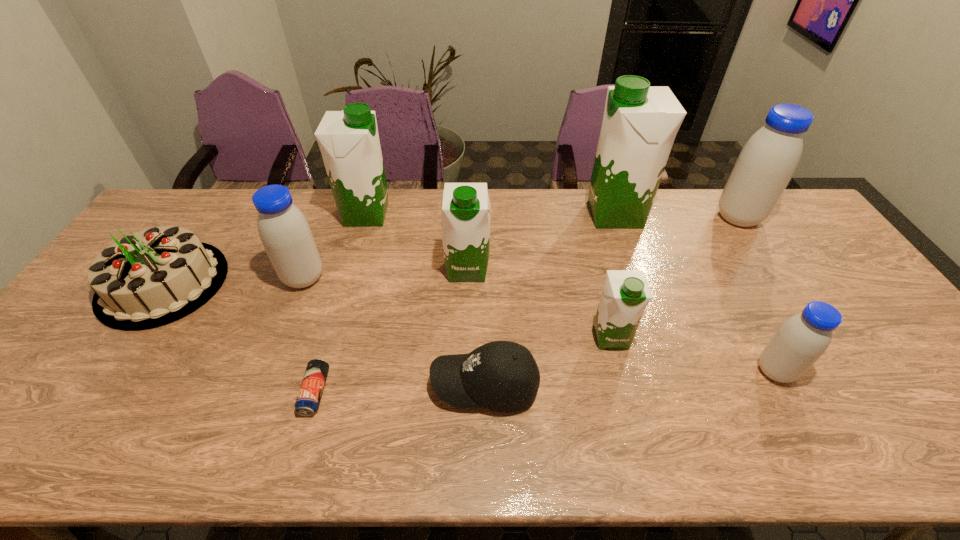
Find the location of `free space in the image that satisfies the following two spatial constraints: 1. on the front-facing side of the ninth object from left to right; 2. on the left side of the third biggest green soya milk`. free space in the image that satisfies the following two spatial constraints: 1. on the front-facing side of the ninth object from left to right; 2. on the left side of the third biggest green soya milk is located at coordinates (465, 371).

This screenshot has height=540, width=960. Identify the location of free region that satisfies the following two spatial constraints: 1. on the front-facing side of the tallest soya milk; 2. on the front-facing side of the second smallest green soya milk. (635, 269).

This screenshot has height=540, width=960. I want to click on free space that satisfies the following two spatial constraints: 1. on the front-facing side of the tallest object; 2. on the back side of the ninth object from left to right, so click(669, 371).

You are a GUI agent. You are given a task and a screenshot of the screen. Output one action in this format:
    pyautogui.click(x=<x>, y=<y>)
    Task: Click on the free point that satisfies the following two spatial constraints: 1. on the front-facing side of the tallest object; 2. on the front-facing side of the fifth soya milk from right to left
    Image resolution: width=960 pixels, height=540 pixels.
    Given the screenshot: What is the action you would take?
    pyautogui.click(x=635, y=269)

I want to click on free spot that satisfies the following two spatial constraints: 1. on the front-facing side of the second soya milk from right to left; 2. on the right side of the third smallest green soya milk, so click(x=321, y=371).